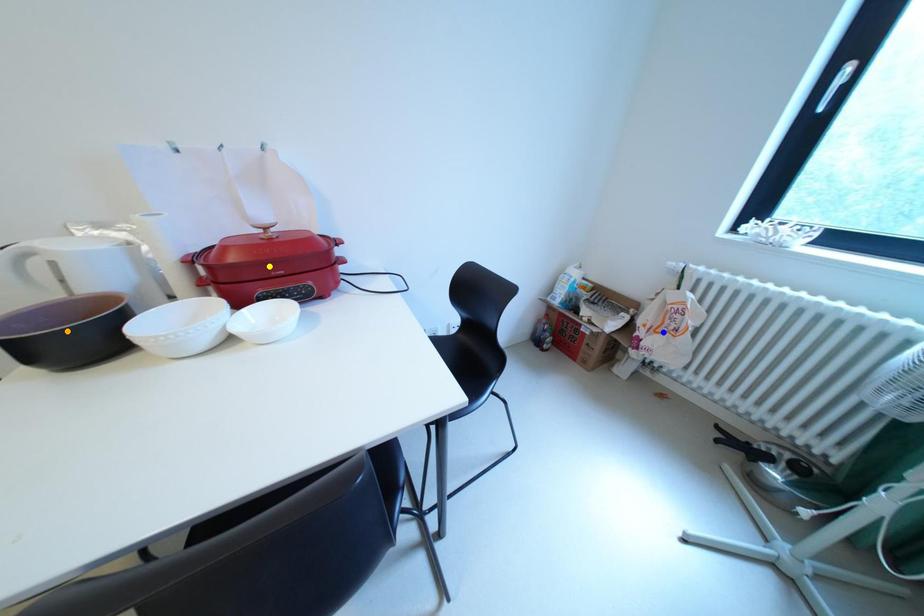
Order these from nearest to farthest:
orange point
yellow point
blue point

orange point → yellow point → blue point